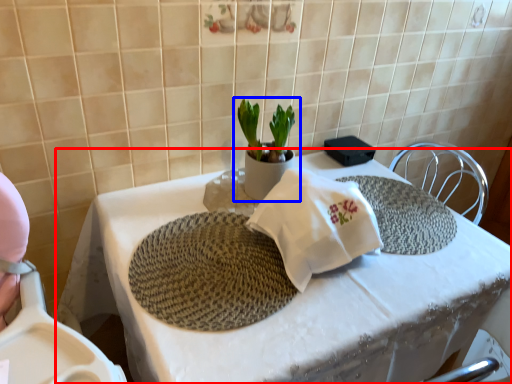
Question: Which of the following is the farthest to the observer, table (highlighted by a red box) or houseplant (highlighted by a blue box)?

Choices:
 (A) table
 (B) houseplant

Answer: (B)